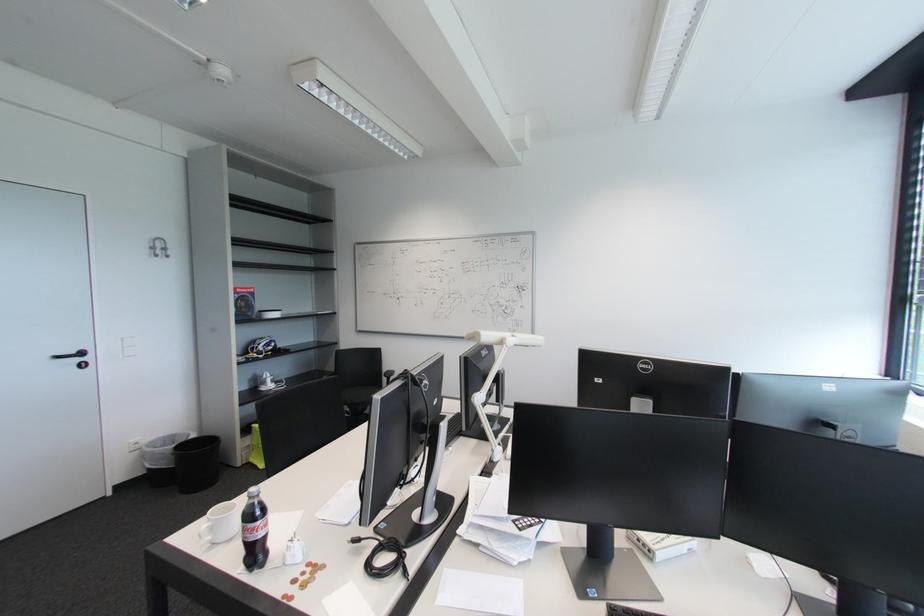
This screenshot has height=616, width=924. I want to click on black door handle, so click(73, 357).